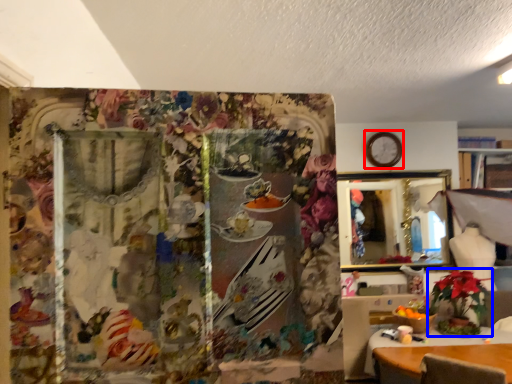
Question: Which point is further to the camera, clock (highlighted by a red box) or houseplant (highlighted by a blue box)?

Choices:
 (A) clock
 (B) houseplant

Answer: (A)